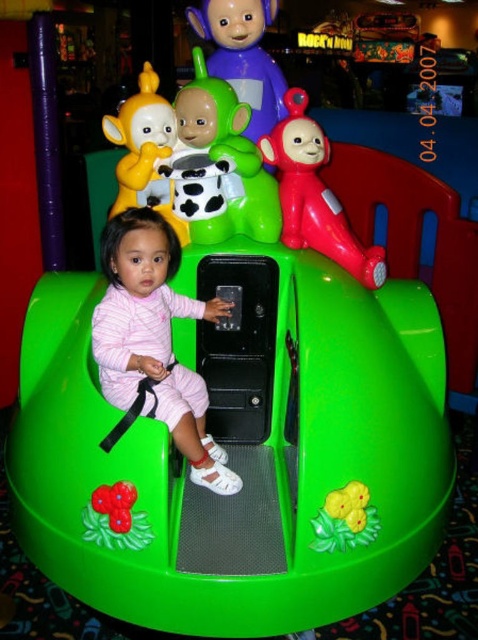
You are a technician checking the positioning of two points on the ride structure. The first point is at coordinates point (177, 100), and the second is at point (119, 486). From the perspective of someone standing in front of the ride, which point is closer to the back of the ride?

Point (177, 100) is behind point (119, 486), so from the front perspective, point (177, 100) is closer to the back of the ride.

You are a parent at an amusement park and see your child on the ride. You notice a cow print plastic cup at upper center and a rubberized green flower at lower left. Which object is higher up?

The cow print plastic cup at upper center is above the rubberized green flower at lower left, so the cow print plastic cup at upper center is higher up.

From the picture: You are a parent trying to locate your child in an amusement park. You see the ride with four Teletubbies on top. Which Teletubby is located at the point with coordinates (243, 56)?

The point (243, 56) corresponds to the purple matte teletubby at upper center.